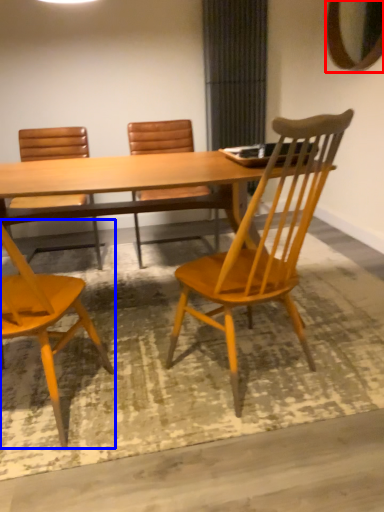
Question: Which of the following is the farthest to the observer, mirror (highlighted by a red box) or chair (highlighted by a blue box)?

Choices:
 (A) mirror
 (B) chair

Answer: (A)